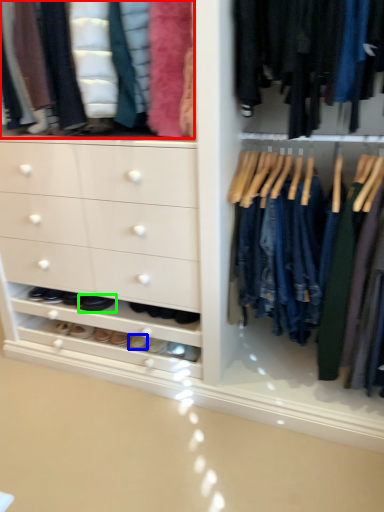
Question: Based on their relative distances, which object is nearer to clothing (highlighted by a red box)? Choose from footwear (highlighted by a blue box) and footwear (highlighted by a green box).

Choices:
 (A) footwear
 (B) footwear

Answer: (B)